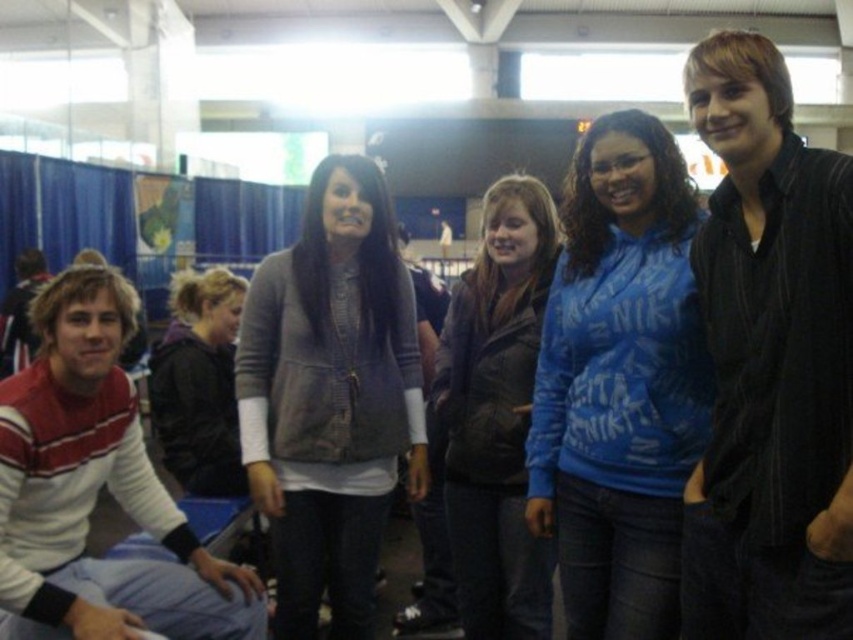
Does red and white striped sweater at left appear on the right side of matte brown jacket at center?

In fact, red and white striped sweater at left is to the left of matte brown jacket at center.

Consider the image. Is red and white striped sweater at left below matte brown jacket at center?

Yes.

Does point (36, 440) come farther from viewer compared to point (518, 176)?

No.

You are a GUI agent. You are given a task and a screenshot of the screen. Output one action in this format:
    pyautogui.click(x=<x>, y=<y>)
    Task: Click on the red and white striped sweater at left
    Image resolution: width=853 pixels, height=640 pixels.
    Given the screenshot: What is the action you would take?
    pyautogui.click(x=96, y=490)

Where is `matte gray jacket at center`? The image size is (853, 640). matte gray jacket at center is located at coordinates (329, 397).

Between matte gray jacket at center and black leather jacket at lower left, which one is positioned higher?

black leather jacket at lower left is above.

Locate an element on the screen. matte gray jacket at center is located at coordinates (329, 397).

The image size is (853, 640). What are the coordinates of `matte gray jacket at center` in the screenshot? It's located at (329, 397).

Is black velvet shirt at right to the left of matte gray jacket at center from the viewer's perspective?

No, black velvet shirt at right is not to the left of matte gray jacket at center.

Is black velvet shirt at right shorter than matte gray jacket at center?

Correct, black velvet shirt at right is not as tall as matte gray jacket at center.

Who is more forward, (744, 400) or (375, 435)?

Point (744, 400) is more forward.

Where is `black velvet shirt at right`? The image size is (853, 640). black velvet shirt at right is located at coordinates (770, 362).